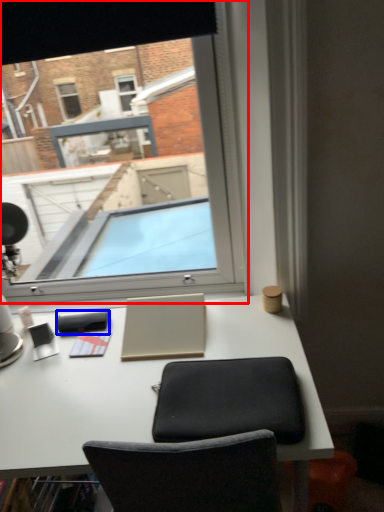
Question: Which of the following is the closest to the observer, window (highlighted by a red box) or notepad (highlighted by a blue box)?

Choices:
 (A) window
 (B) notepad

Answer: (A)